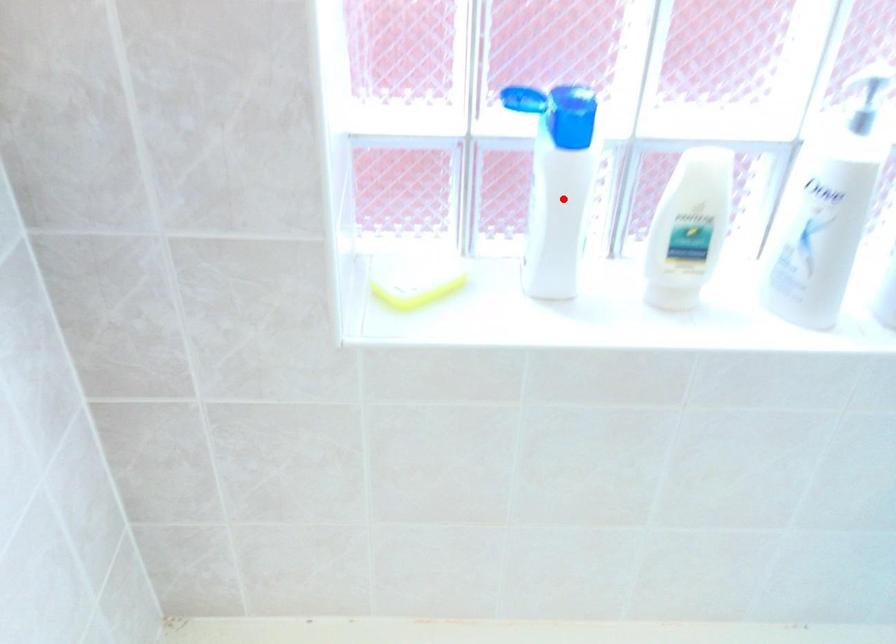
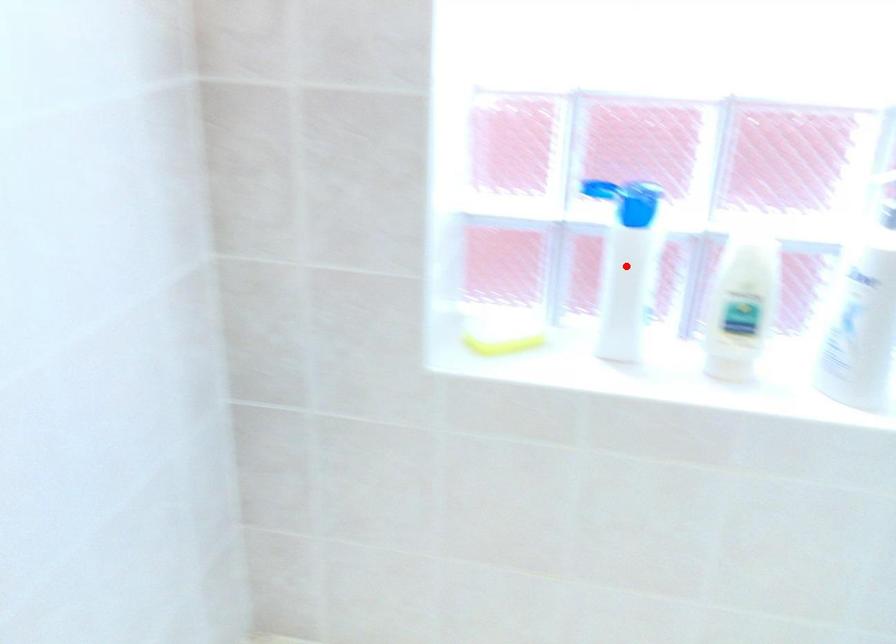
I am providing you with two images of the same scene from different viewpoints. A red point is marked on the first image and another point is marked on the second image. Is the red point in image1 aligned with the point shown in image2?

Yes